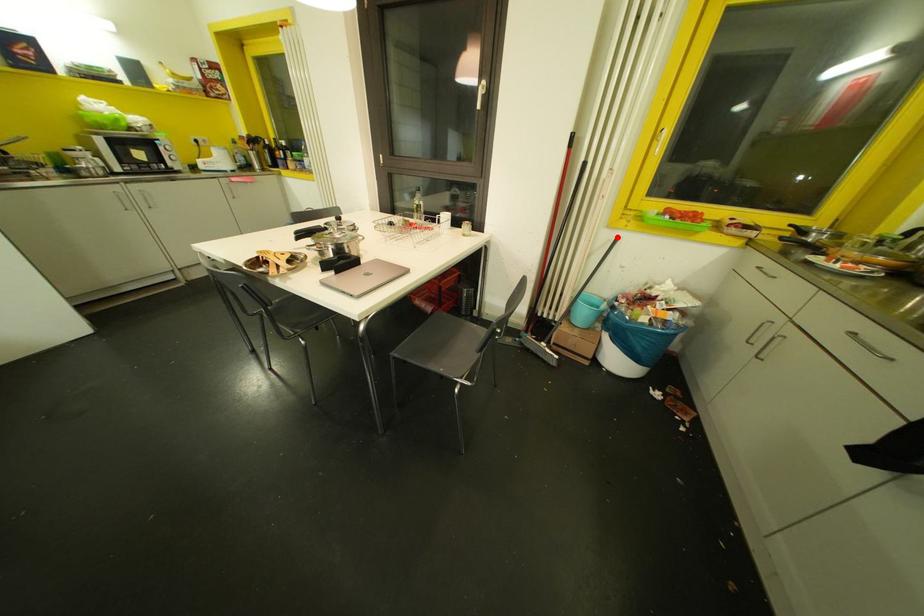
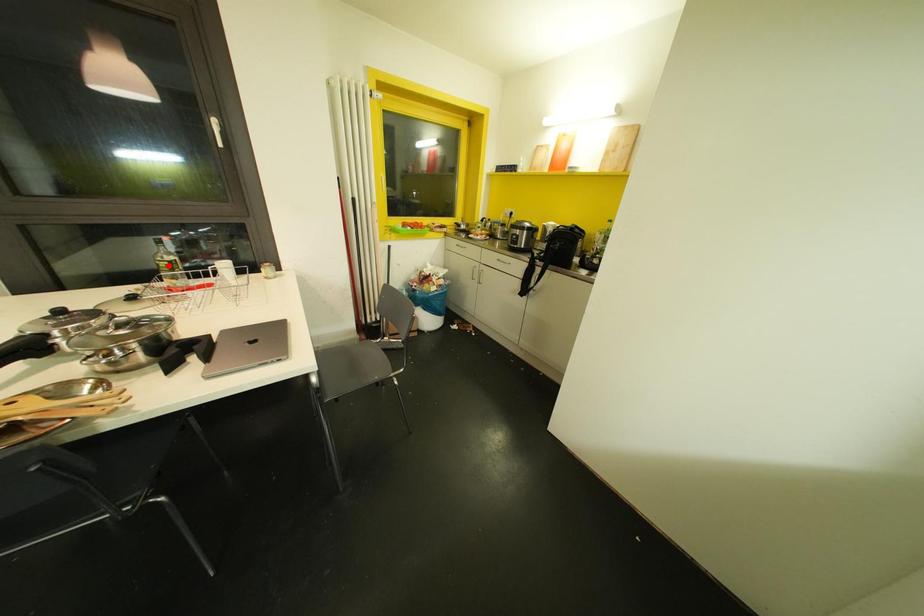
I am providing you with two images of the same scene from different viewpoints. A red point is marked on the first image and another point is marked on the second image. Are the points marked in image1 and image2 representing the same 3D position?

No